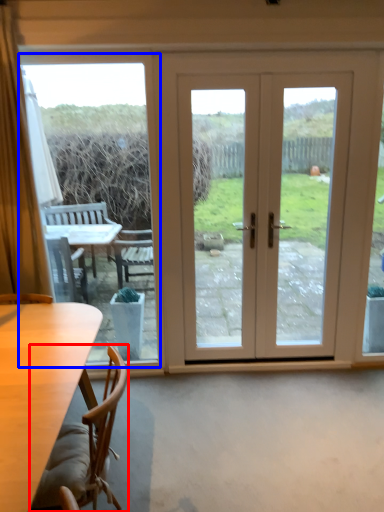
Question: Which point is closer to the camera, chair (highlighted by a red box) or window screen (highlighted by a blue box)?

Choices:
 (A) chair
 (B) window screen

Answer: (A)